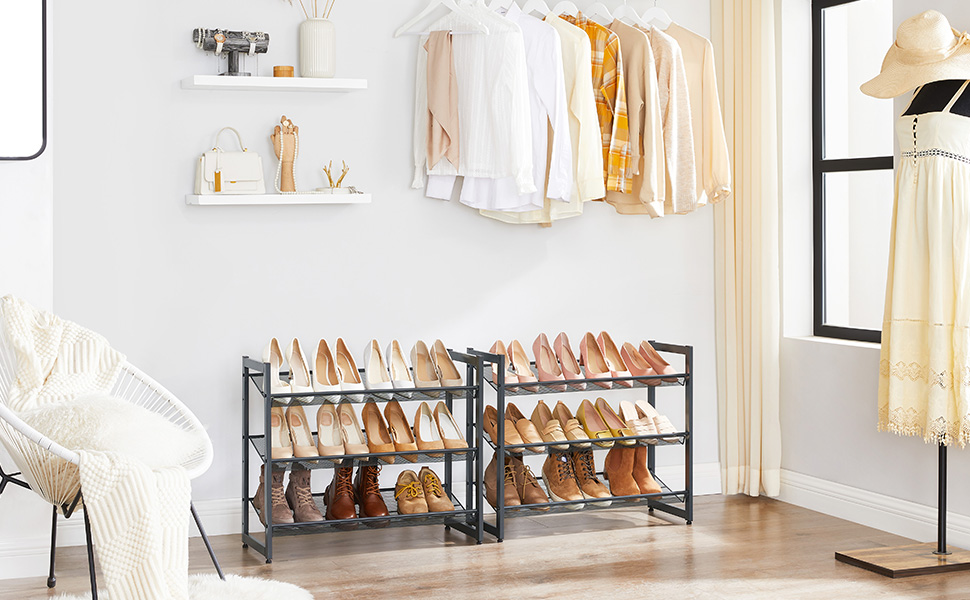
Identify the location of hanging hangers. The height and width of the screenshot is (600, 970). (469, 17), (474, 2), (500, 5), (534, 7), (564, 7), (596, 8), (629, 11), (653, 13).